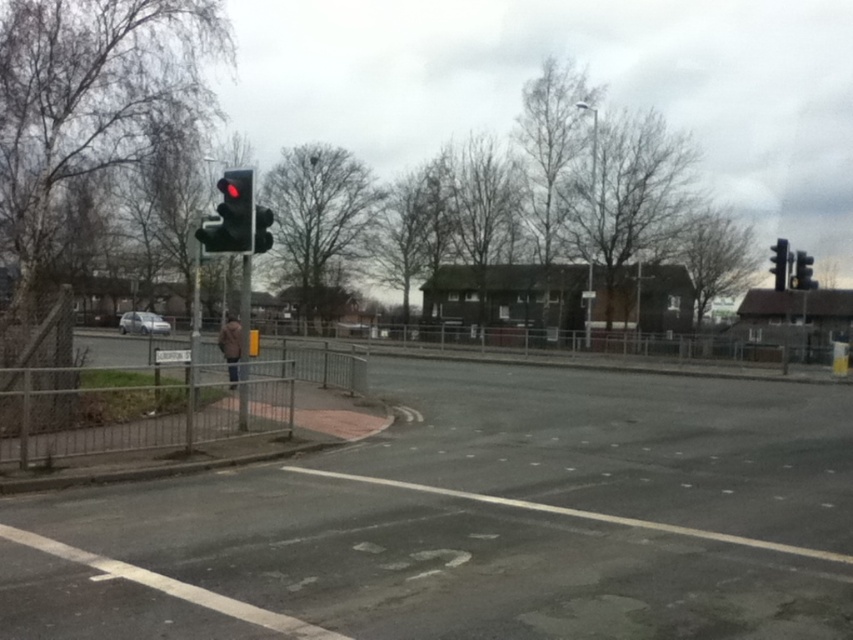
Which is in front, point (242, 262) or point (802, 262)?

Positioned in front is point (242, 262).

Does metallic pole at left appear under yellow matte traffic light at right?

Correct, metallic pole at left is located below yellow matte traffic light at right.

Which is behind, point (244, 326) or point (805, 282)?

Positioned behind is point (805, 282).

At what (x,y) coordinates should I click in order to perform the action: click on metallic pole at left. Please return your answer as a coordinate pair (x, y). The height and width of the screenshot is (640, 853). Looking at the image, I should click on (242, 340).

Is silver metallic car at lower left shorter than black glass traffic light at upper left?

No.

How distant is silver metallic car at lower left from black glass traffic light at upper left?

silver metallic car at lower left is 128.34 feet away from black glass traffic light at upper left.

Does point (143, 332) come in front of point (267, 208)?

Yes, it is.

Find the location of a particular element. This screenshot has height=640, width=853. silver metallic car at lower left is located at coordinates (142, 323).

Between yellow matte traffic light at right and white plastic street sign at upper center, which one has less height?

Standing shorter between the two is white plastic street sign at upper center.

Which is more to the right, yellow matte traffic light at right or white plastic street sign at upper center?

yellow matte traffic light at right

At what (x,y) coordinates should I click in order to perform the action: click on yellow matte traffic light at right. Please return your answer as a coordinate pair (x, y). The height and width of the screenshot is (640, 853). Looking at the image, I should click on (804, 272).